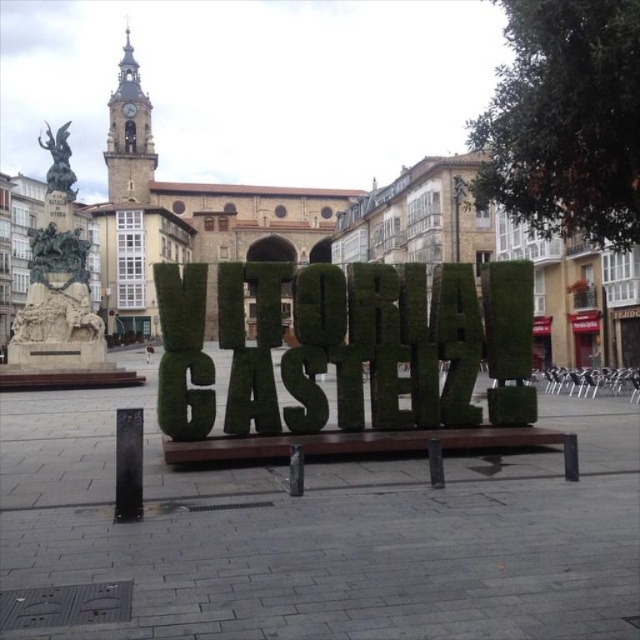
In the scene shown: You are standing at the entrance of the square and want to find the green mossy letter at center. According to the coordinates provided, where should you look relative to the square?

The green mossy letter at center is located at coordinates point (385, 346), which is near the center of the square slightly to the right and lower half.

You are standing in the urban square and want to place a small flowerpot between the green mossy letter at center and the green grass sign at center. Which object should you place the flowerpot closer to if you want it to be lower to the ground?

The green grass sign at center is lower than the green mossy letter at center, so placing the flowerpot closer to the green grass sign at center will keep it lower to the ground.

You are a city planner assessing the urban square. You need to determine if the green mossy letter at center will block the view of the green grass sign at center from a pedestrian standing at the square entrance. Based on their heights, can you conclude this?

The green mossy letter at center is taller than the green grass sign at center, so it may block the view of the green grass sign at center depending on their exact positions.